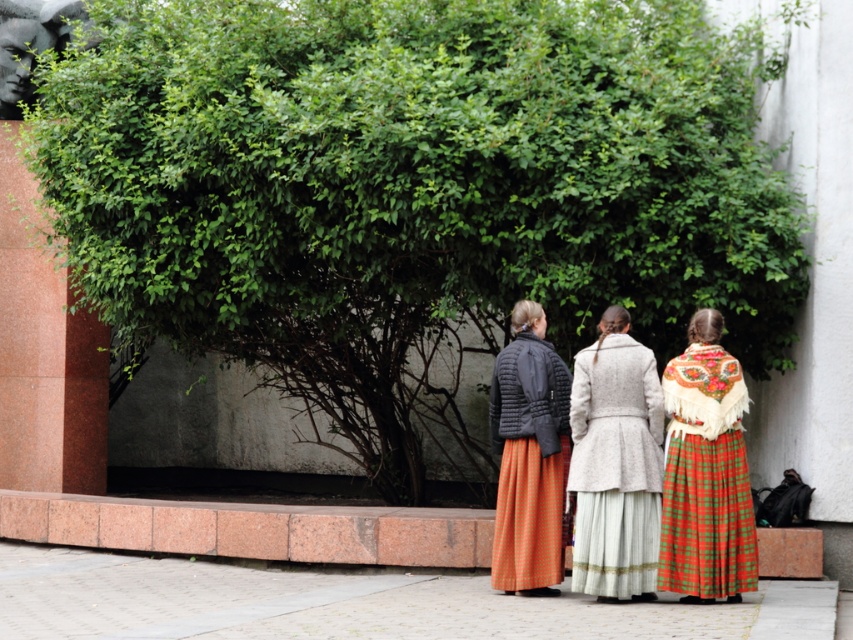
Between point (683, 465) and point (566, 394), which one is positioned in front?

Point (683, 465) is more forward.

Locate an element on the screen. This screenshot has height=640, width=853. plaid wool skirt at center is located at coordinates (705, 472).

The height and width of the screenshot is (640, 853). What do you see at coordinates (705, 472) in the screenshot? I see `plaid wool skirt at center` at bounding box center [705, 472].

What are the coordinates of `plaid wool skirt at center` in the screenshot? It's located at (705, 472).

Find the location of a particular element. The width and height of the screenshot is (853, 640). plaid wool skirt at center is located at coordinates (705, 472).

Is red granite pillar at left above brushed metal sculpture at upper left?

Incorrect, red granite pillar at left is not positioned above brushed metal sculpture at upper left.

What do you see at coordinates (44, 355) in the screenshot? I see `red granite pillar at left` at bounding box center [44, 355].

Is point (10, 237) farther from viewer compared to point (7, 8)?

No, it is not.

At what (x,y) coordinates should I click in order to perform the action: click on red granite pillar at left. Please return your answer as a coordinate pair (x, y). The height and width of the screenshot is (640, 853). Looking at the image, I should click on (44, 355).